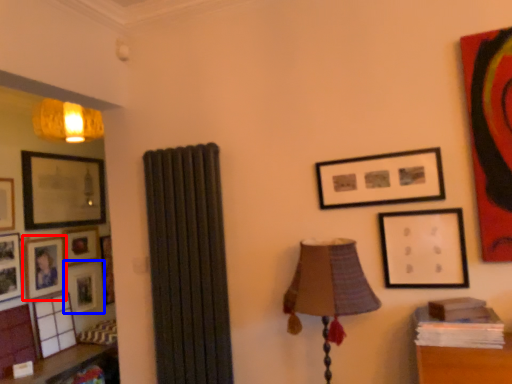
Question: Which of the following is the farthest to the observer, picture frame (highlighted by a red box) or picture frame (highlighted by a blue box)?

Choices:
 (A) picture frame
 (B) picture frame

Answer: (B)